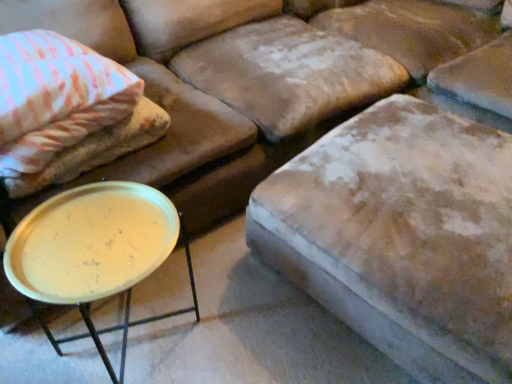
Question: Considering the relative sizes of pink striped fabric pillow at upper left and velvet beige ottoman at center in the image provided, is pink striped fabric pillow at upper left taller than velvet beige ottoman at center?

Choices:
 (A) yes
 (B) no

Answer: (B)

Question: Considering the relative sizes of pink striped fabric pillow at upper left and velvet beige ottoman at center in the image provided, is pink striped fabric pillow at upper left wider than velvet beige ottoman at center?

Choices:
 (A) yes
 (B) no

Answer: (B)

Question: Is pink striped fabric pillow at upper left closer to the viewer compared to velvet beige ottoman at center?

Choices:
 (A) yes
 (B) no

Answer: (B)

Question: Would you say pink striped fabric pillow at upper left is outside velvet beige ottoman at center?

Choices:
 (A) no
 (B) yes

Answer: (B)

Question: Is pink striped fabric pillow at upper left further to camera compared to velvet beige ottoman at center?

Choices:
 (A) yes
 (B) no

Answer: (A)

Question: Considering the positions of point (380, 139) and point (86, 188), is point (380, 139) closer or farther from the camera than point (86, 188)?

Choices:
 (A) closer
 (B) farther

Answer: (B)

Question: Based on their positions, is velvet beige ottoman at center located to the left or right of metallic gold tray at lower left?

Choices:
 (A) right
 (B) left

Answer: (A)

Question: Considering the positions of velvet beige ottoman at center and metallic gold tray at lower left in the image, is velvet beige ottoman at center bigger or smaller than metallic gold tray at lower left?

Choices:
 (A) big
 (B) small

Answer: (A)

Question: Is velvet beige ottoman at center in front of or behind metallic gold tray at lower left in the image?

Choices:
 (A) behind
 (B) front

Answer: (B)

Question: In terms of width, does velvet beige ottoman at center look wider or thinner when compared to pink striped fabric pillow at upper left?

Choices:
 (A) wide
 (B) thin

Answer: (A)

Question: Relative to pink striped fabric pillow at upper left, is velvet beige ottoman at center in front or behind?

Choices:
 (A) front
 (B) behind

Answer: (A)

Question: Visually, is velvet beige ottoman at center positioned to the left or to the right of pink striped fabric pillow at upper left?

Choices:
 (A) right
 (B) left

Answer: (A)

Question: From their relative heights in the image, would you say velvet beige ottoman at center is taller or shorter than pink striped fabric pillow at upper left?

Choices:
 (A) short
 (B) tall

Answer: (B)

Question: In terms of height, does metallic gold tray at lower left look taller or shorter compared to velvet beige ottoman at center?

Choices:
 (A) tall
 (B) short

Answer: (A)

Question: From the image's perspective, is metallic gold tray at lower left located above or below velvet beige ottoman at center?

Choices:
 (A) above
 (B) below

Answer: (B)